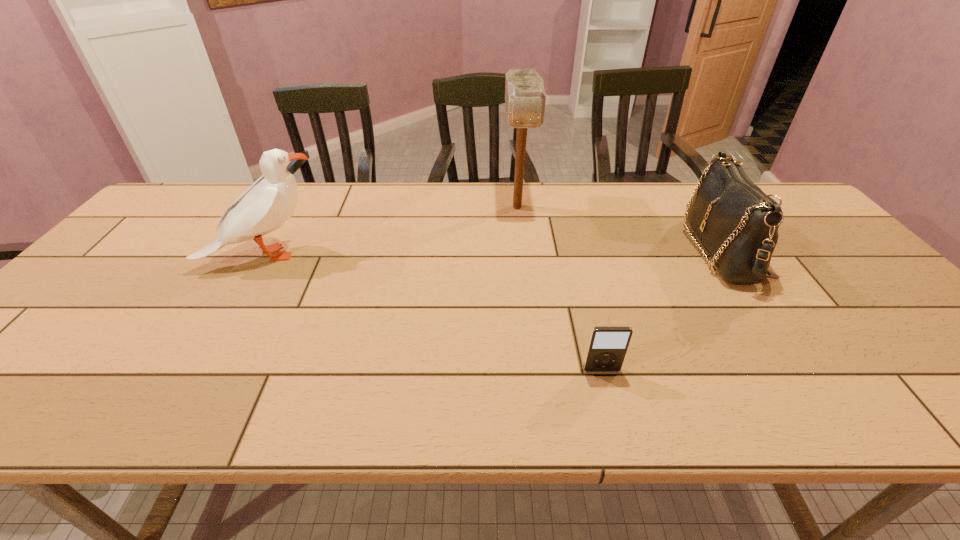
Where is `vacant space that satisfies the following two spatial constraints: 1. at the front of the rightmost object with chain and zipper; 2. on the front-facing side of the iPod`? vacant space that satisfies the following two spatial constraints: 1. at the front of the rightmost object with chain and zipper; 2. on the front-facing side of the iPod is located at coordinates (800, 370).

The image size is (960, 540). Find the location of `free spot that satisfies the following two spatial constraints: 1. on the striking face of the second object from left to right; 2. at the beak of the leftmost object`. free spot that satisfies the following two spatial constraints: 1. on the striking face of the second object from left to right; 2. at the beak of the leftmost object is located at coordinates (523, 255).

Identify the location of free location that satisfies the following two spatial constraints: 1. at the front of the third tallest object with chain and zipper; 2. on the front-facing side of the shortest object. (800, 370).

Identify the location of free space in the image that satisfies the following two spatial constraints: 1. at the front of the handbag with chain and zipper; 2. on the front-facing side of the shortest object. Image resolution: width=960 pixels, height=540 pixels. (800, 370).